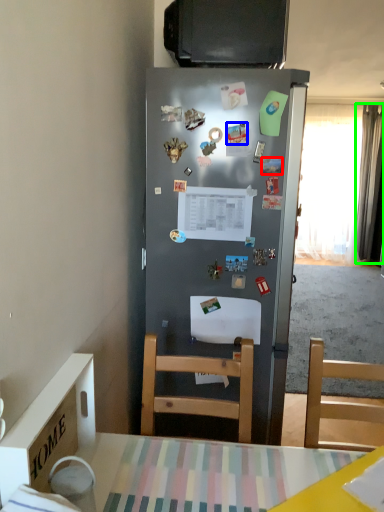
Question: Which object is positioned closest to magnet (highlighted by a red box)? Select from magnet (highlighted by a blue box) and curtain (highlighted by a green box).

Choices:
 (A) magnet
 (B) curtain

Answer: (A)